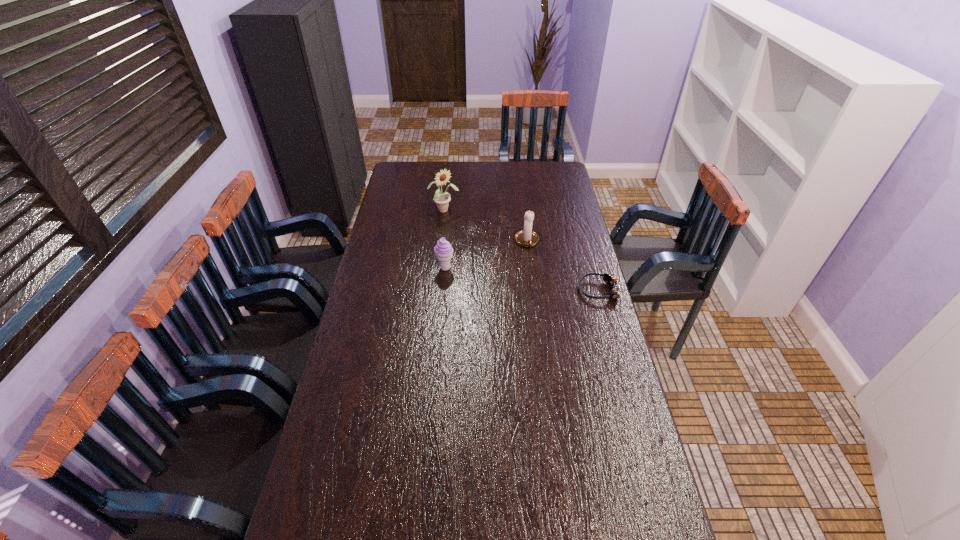
Find the location of a particular element. The height and width of the screenshot is (540, 960). free space between the second nearest object and the third nearest object is located at coordinates (486, 255).

This screenshot has width=960, height=540. Identify the location of vacant space in between the goggles and the candle holder. (563, 266).

Where is `object that is the third closest to the sunflower`? object that is the third closest to the sunflower is located at coordinates (611, 280).

Identify the location of object that can be found as the third closest to the farthest object. This screenshot has width=960, height=540. (611, 280).

The height and width of the screenshot is (540, 960). In order to click on free space that satisfies the following two spatial constraints: 1. on the front side of the third farthest object; 2. through the lenses of the nearest object in this screenshot , I will do `click(443, 290)`.

Locate an element on the screen. vacant space that satisfies the following two spatial constraints: 1. on the front side of the second farthest object; 2. through the lenses of the goggles is located at coordinates pyautogui.click(x=533, y=290).

You are a GUI agent. You are given a task and a screenshot of the screen. Output one action in this format:
    pyautogui.click(x=<x>, y=<y>)
    Task: Click on the vacant space that satisfies the following two spatial constraints: 1. on the front side of the goggles; 2. through the lenses of the candle holder
    This screenshot has height=540, width=960.
    Given the screenshot: What is the action you would take?
    pyautogui.click(x=533, y=290)

The image size is (960, 540). Identify the location of free space that satisfies the following two spatial constraints: 1. on the front side of the shortest object; 2. through the lenses of the farthest object. (436, 290).